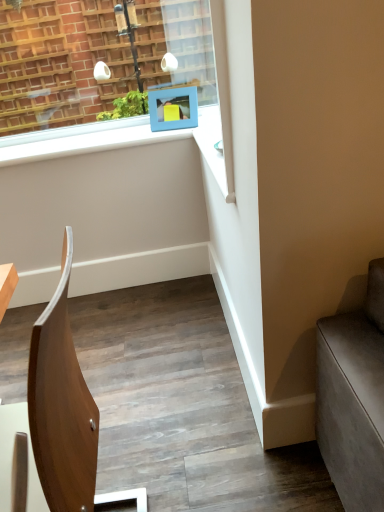
Question: Is blue matte picture frame at upper center a part of wooden chair at center?

Choices:
 (A) yes
 (B) no

Answer: (B)

Question: From the image's perspective, is wooden chair at center beneath blue matte picture frame at upper center?

Choices:
 (A) yes
 (B) no

Answer: (A)

Question: Is wooden chair at center touching blue matte picture frame at upper center?

Choices:
 (A) no
 (B) yes

Answer: (A)

Question: Is there a large distance between wooden chair at center and blue matte picture frame at upper center?

Choices:
 (A) no
 (B) yes

Answer: (B)

Question: From the image's perspective, is wooden chair at center over blue matte picture frame at upper center?

Choices:
 (A) yes
 (B) no

Answer: (B)

Question: From a real-world perspective, is wooden chair at center on top of blue matte picture frame at upper center?

Choices:
 (A) no
 (B) yes

Answer: (A)

Question: Is blue matte picture frame at upper center to the right of wooden chair at center from the viewer's perspective?

Choices:
 (A) no
 (B) yes

Answer: (B)

Question: From a real-world perspective, is blue matte picture frame at upper center physically above wooden chair at center?

Choices:
 (A) no
 (B) yes

Answer: (B)

Question: Would you say blue matte picture frame at upper center contains wooden chair at center?

Choices:
 (A) no
 (B) yes

Answer: (A)

Question: Is blue matte picture frame at upper center smaller than wooden chair at center?

Choices:
 (A) no
 (B) yes

Answer: (B)

Question: Is blue matte picture frame at upper center positioned with its back to wooden chair at center?

Choices:
 (A) yes
 (B) no

Answer: (B)

Question: Would you say blue matte picture frame at upper center is outside wooden chair at center?

Choices:
 (A) no
 (B) yes

Answer: (B)

Question: In terms of size, does blue matte picture frame at upper center appear bigger or smaller than wooden chair at center?

Choices:
 (A) small
 (B) big

Answer: (A)